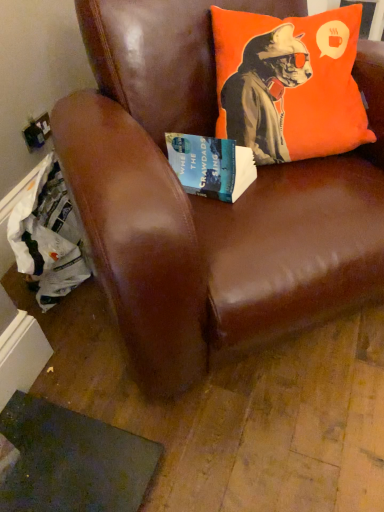
Question: Is brown leather chair at upper center not within orange fabric pillow at upper right?

Choices:
 (A) yes
 (B) no

Answer: (A)

Question: From a real-world perspective, is brown leather chair at upper center physically above orange fabric pillow at upper right?

Choices:
 (A) no
 (B) yes

Answer: (A)

Question: Considering the relative sizes of brown leather chair at upper center and orange fabric pillow at upper right in the image provided, is brown leather chair at upper center wider than orange fabric pillow at upper right?

Choices:
 (A) no
 (B) yes

Answer: (B)

Question: From a real-world perspective, is brown leather chair at upper center positioned under orange fabric pillow at upper right based on gravity?

Choices:
 (A) no
 (B) yes

Answer: (B)

Question: Could you tell me if brown leather chair at upper center is turned towards orange fabric pillow at upper right?

Choices:
 (A) no
 (B) yes

Answer: (B)

Question: Considering the relative sizes of brown leather chair at upper center and orange fabric pillow at upper right in the image provided, is brown leather chair at upper center shorter than orange fabric pillow at upper right?

Choices:
 (A) yes
 (B) no

Answer: (B)

Question: From the image's perspective, is orange fabric pillow at upper right beneath brown leather chair at upper center?

Choices:
 (A) no
 (B) yes

Answer: (A)

Question: Considering the relative sizes of orange fabric pillow at upper right and brown leather chair at upper center in the image provided, is orange fabric pillow at upper right bigger than brown leather chair at upper center?

Choices:
 (A) yes
 (B) no

Answer: (B)

Question: Considering the relative sizes of orange fabric pillow at upper right and brown leather chair at upper center in the image provided, is orange fabric pillow at upper right shorter than brown leather chair at upper center?

Choices:
 (A) no
 (B) yes

Answer: (B)

Question: Is orange fabric pillow at upper right not inside brown leather chair at upper center?

Choices:
 (A) yes
 (B) no

Answer: (B)

Question: Is the depth of orange fabric pillow at upper right less than that of brown leather chair at upper center?

Choices:
 (A) no
 (B) yes

Answer: (A)

Question: From a real-world perspective, is orange fabric pillow at upper right beneath brown leather chair at upper center?

Choices:
 (A) yes
 (B) no

Answer: (B)

Question: From a real-world perspective, is hardcover book at center under orange fabric pillow at upper right?

Choices:
 (A) no
 (B) yes

Answer: (B)